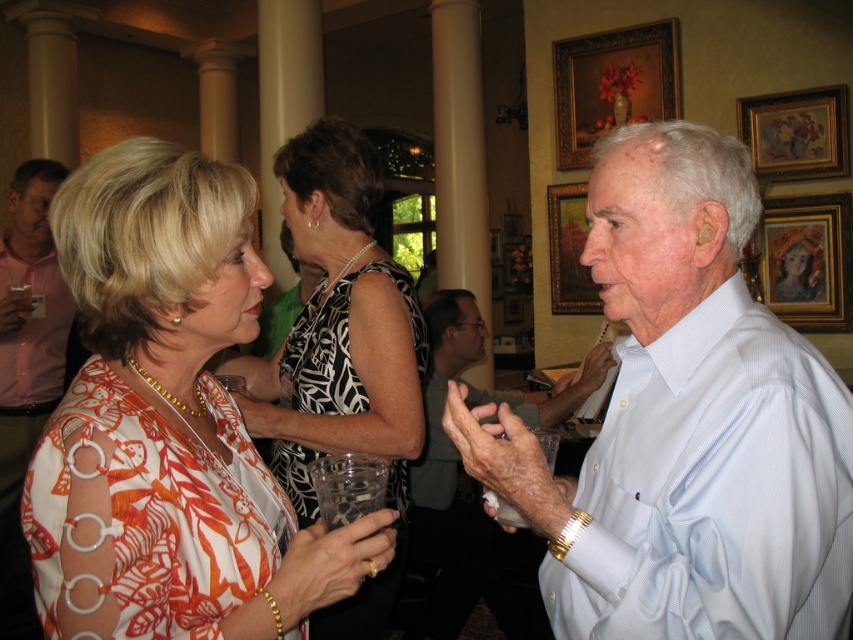
Which of these two, white button-down shirt at center or wooden framed portrait at upper right, stands taller?

white button-down shirt at center is taller.

Who is shorter, white button-down shirt at center or wooden framed portrait at upper right?

wooden framed portrait at upper right

Does point (759, 573) come behind point (827, 308)?

No, it is in front of (827, 308).

Find the location of a particular element. The width and height of the screenshot is (853, 640). white button-down shirt at center is located at coordinates (686, 424).

Is point (331, 132) positioned after point (492, 547)?

No, it is not.

Which is in front, point (285, 442) or point (492, 397)?

Positioned in front is point (285, 442).

You are a GUI agent. You are given a task and a screenshot of the screen. Output one action in this format:
    pyautogui.click(x=<x>, y=<y>)
    Task: Click on the white printed dress at center
    This screenshot has height=640, width=853.
    Given the screenshot: What is the action you would take?
    pyautogui.click(x=341, y=352)

Can you confirm if white printed dress at center is wider than pink shirt at left?

In fact, white printed dress at center might be narrower than pink shirt at left.

Between white printed dress at center and pink shirt at left, which one appears on the right side from the viewer's perspective?

From the viewer's perspective, white printed dress at center appears more on the right side.

What do you see at coordinates (341, 352) in the screenshot? The width and height of the screenshot is (853, 640). I see `white printed dress at center` at bounding box center [341, 352].

You are a GUI agent. You are given a task and a screenshot of the screen. Output one action in this format:
    pyautogui.click(x=<x>, y=<y>)
    Task: Click on the white printed dress at center
    Image resolution: width=853 pixels, height=640 pixels.
    Given the screenshot: What is the action you would take?
    coord(341,352)